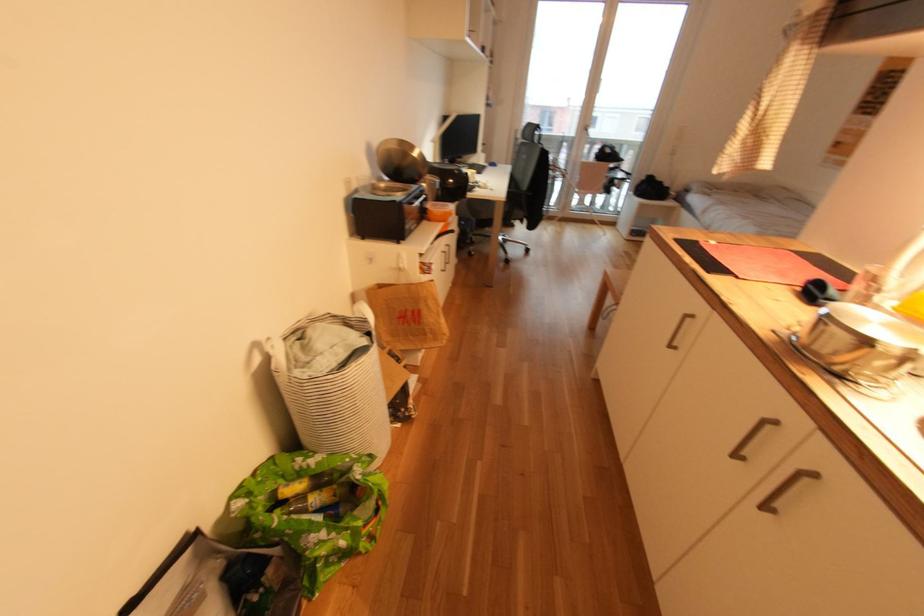
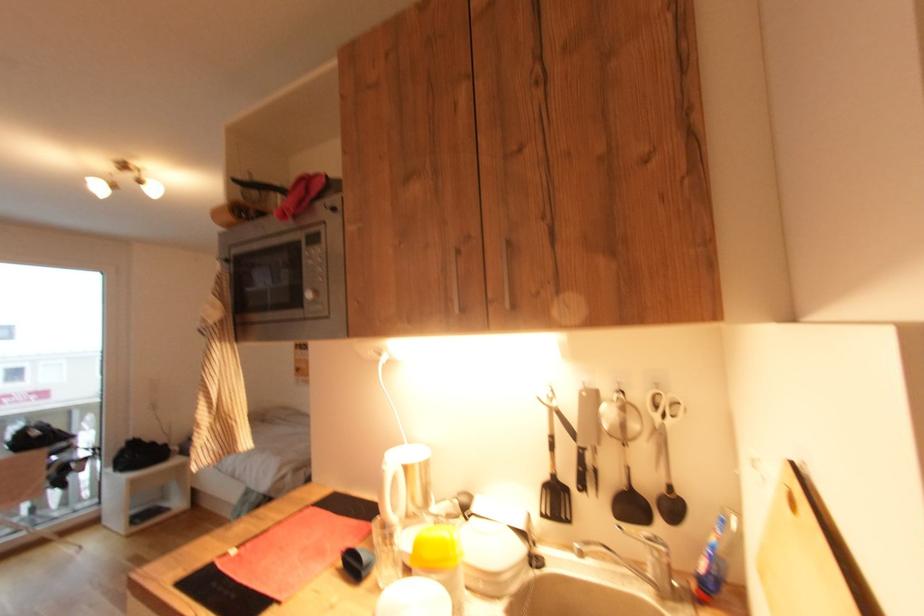
Question: The camera is either moving clockwise (left) or counter-clockwise (right) around the object. The first image is from the beginning of the video and the second image is from the end. Is the camera moving left or right when shooting the video?

Choices:
 (A) Left
 (B) Right

Answer: (A)